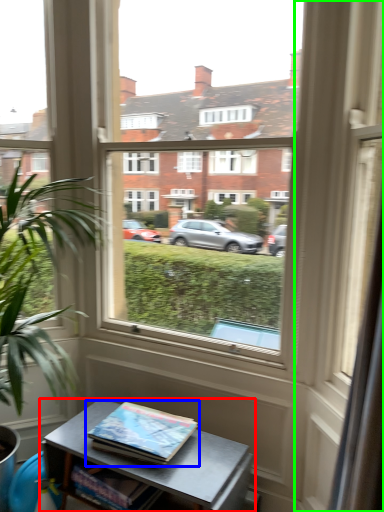
Question: Which object is the farthest from table (highlighted by a red box)? Choose among these: book (highlighted by a blue box) or glass door (highlighted by a green box).

Choices:
 (A) book
 (B) glass door

Answer: (B)